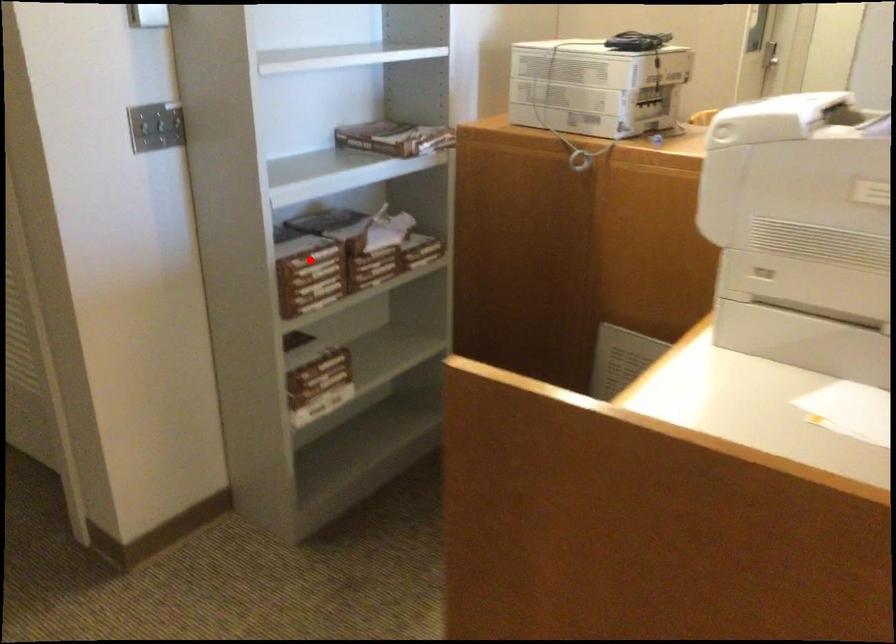
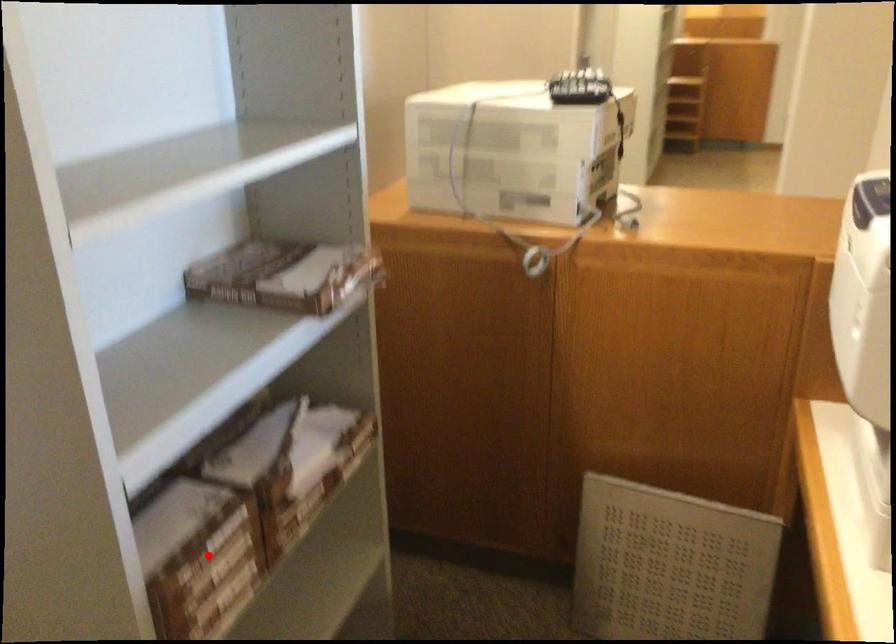
I am providing you with two images of the same scene from different viewpoints. A red point is marked on the first image and another point is marked on the second image. Do the highlighted points in image1 and image2 indicate the same real-world spot?

Yes